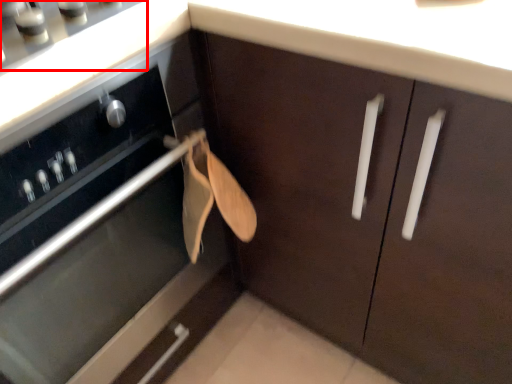
Question: From the image's perspective, where is gas stove (annotated by the red box) located relative to cabinetry?

Choices:
 (A) above
 (B) below

Answer: (A)